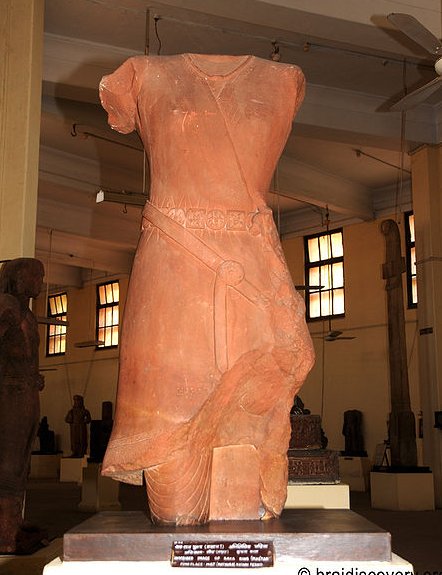
Find the location of `window`. window is located at coordinates (324, 255).